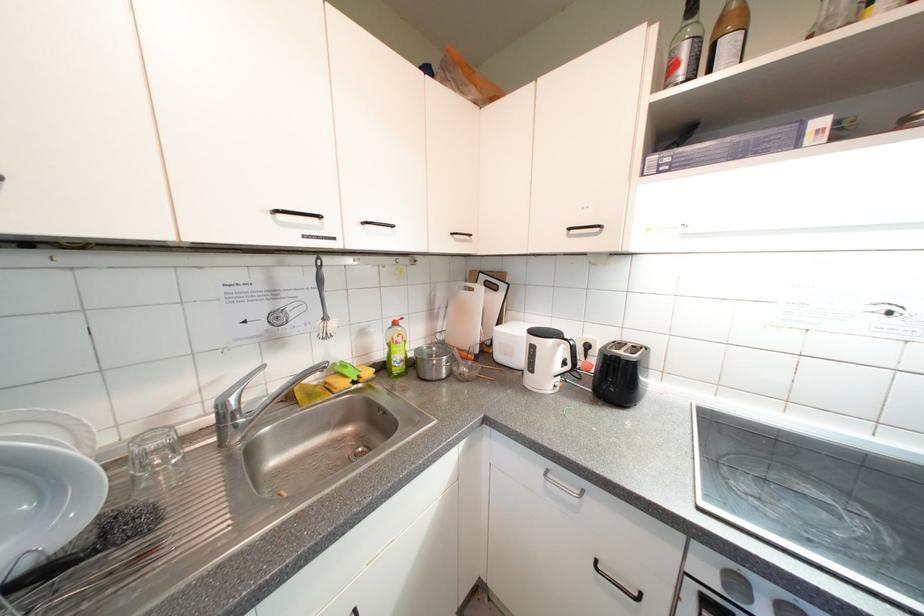
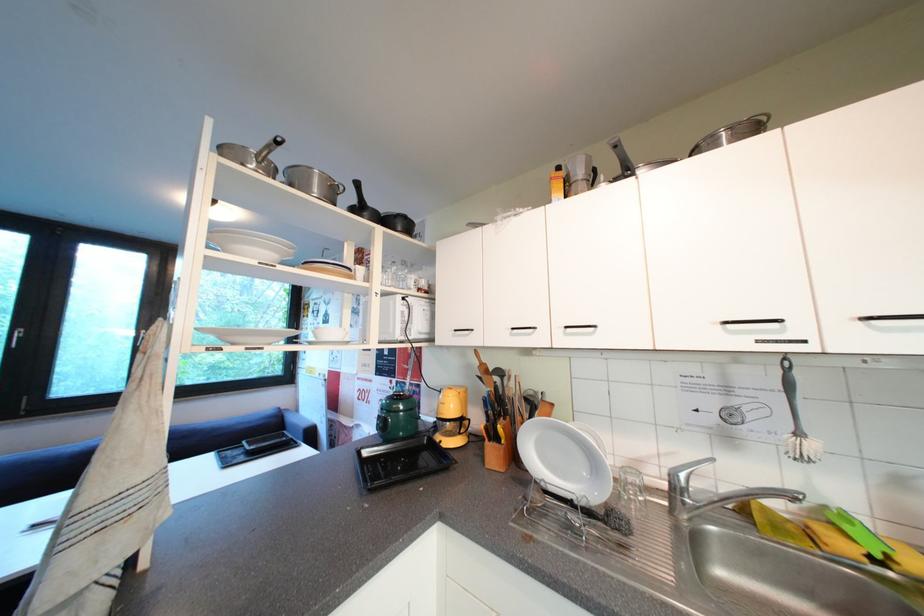
Question: The images are taken continuously from a first-person perspective. In which direction is your viewpoint rotating?

Choices:
 (A) Left
 (B) Right
 (C) Up
 (D) Down

Answer: (A)